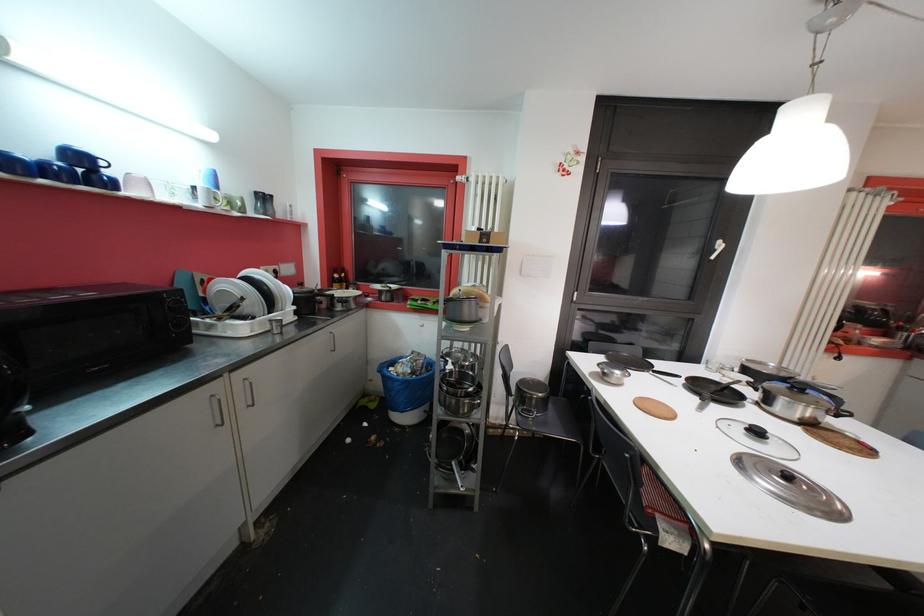
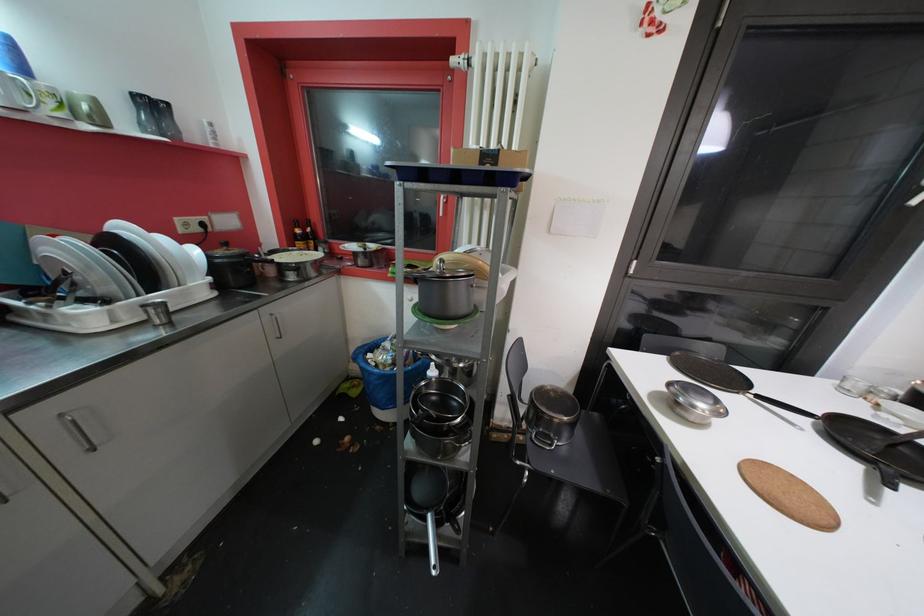
Question: Which direction would the cameraman need to move to produce the second image? Reply with the corresponding letter.

Choices:
 (A) Left
 (B) Right
 (C) Forward
 (D) Backward

Answer: (C)